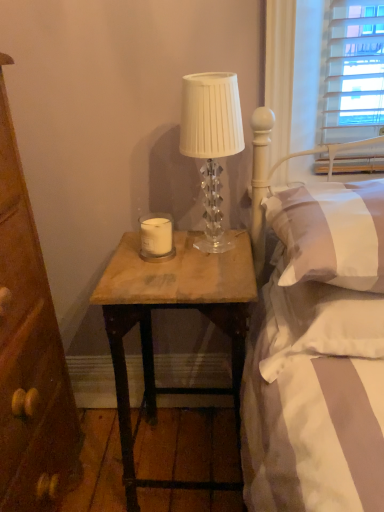
Locate an element on the screen. This screenshot has width=384, height=512. vacant space situated on the left part of white matte candle at center is located at coordinates (127, 253).